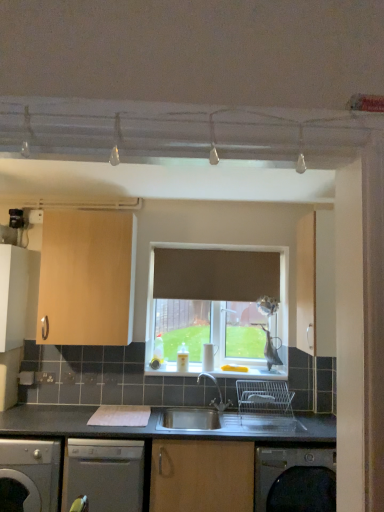
Question: Does matte wood cabinet at right, the 1th cabinetry positioned from the right, have a lesser height compared to light wood cabinet at upper left, which appears as the second cabinetry when viewed from the left?

Choices:
 (A) no
 (B) yes

Answer: (A)

Question: Is matte wood cabinet at right, arranged as the third cabinetry when viewed from the left, at the left side of light wood cabinet at upper left, which appears as the second cabinetry when viewed from the left?

Choices:
 (A) no
 (B) yes

Answer: (A)

Question: Is matte wood cabinet at right, arranged as the third cabinetry when viewed from the left, surrounding light wood cabinet at upper left, which is the 2th cabinetry in right-to-left order?

Choices:
 (A) no
 (B) yes

Answer: (A)

Question: Is matte wood cabinet at right, the 1th cabinetry positioned from the right, oriented towards light wood cabinet at upper left, which is the 2th cabinetry in right-to-left order?

Choices:
 (A) yes
 (B) no

Answer: (A)

Question: Is matte wood cabinet at right, arranged as the third cabinetry when viewed from the left, thinner than light wood cabinet at upper left, which is the 2th cabinetry in right-to-left order?

Choices:
 (A) no
 (B) yes

Answer: (A)

Question: From a real-world perspective, is white glossy window sill at center positioned above or below white matte cabinet at left, marked as the third cabinetry in a right-to-left arrangement?

Choices:
 (A) below
 (B) above

Answer: (A)

Question: In terms of size, does white glossy window sill at center appear bigger or smaller than white matte cabinet at left, marked as the third cabinetry in a right-to-left arrangement?

Choices:
 (A) small
 (B) big

Answer: (A)

Question: In terms of height, does white glossy window sill at center look taller or shorter compared to white matte cabinet at left, which appears as the 1th cabinetry when viewed from the left?

Choices:
 (A) short
 (B) tall

Answer: (A)

Question: Do you think white glossy window sill at center is within white matte cabinet at left, which appears as the 1th cabinetry when viewed from the left, or outside of it?

Choices:
 (A) inside
 (B) outside

Answer: (B)

Question: From a real-world perspective, relative to light wood cabinet at upper left, which is the 2th cabinetry in right-to-left order, is stainless steel sink at center vertically above or below?

Choices:
 (A) above
 (B) below

Answer: (B)

Question: From the image's perspective, is stainless steel sink at center positioned above or below light wood cabinet at upper left, which appears as the second cabinetry when viewed from the left?

Choices:
 (A) below
 (B) above

Answer: (A)

Question: Is point (178, 407) positioned closer to the camera than point (66, 243)?

Choices:
 (A) farther
 (B) closer

Answer: (A)

Question: Relative to light wood cabinet at upper left, which appears as the second cabinetry when viewed from the left, is stainless steel sink at center in front or behind?

Choices:
 (A) behind
 (B) front

Answer: (B)

Question: In terms of width, does white matte cabinet at left, marked as the third cabinetry in a right-to-left arrangement, look wider or thinner when compared to matte wood cabinet at right, arranged as the third cabinetry when viewed from the left?

Choices:
 (A) wide
 (B) thin

Answer: (B)

Question: From the image's perspective, is white matte cabinet at left, which appears as the 1th cabinetry when viewed from the left, positioned above or below matte wood cabinet at right, the 1th cabinetry positioned from the right?

Choices:
 (A) above
 (B) below

Answer: (B)